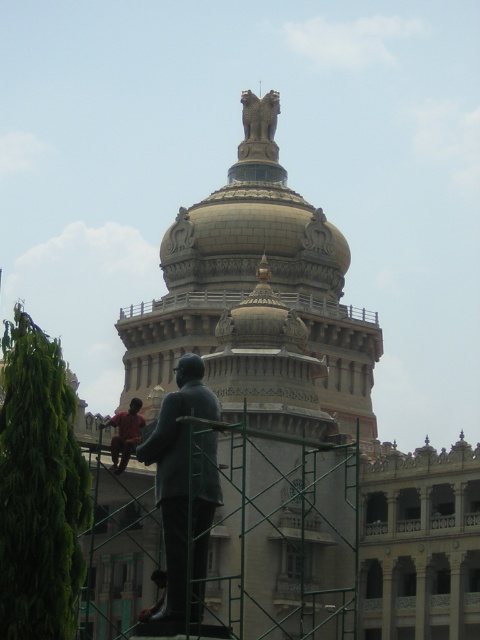
Question: Which point is closer to the camera?

Choices:
 (A) gold stone dome at upper center
 (B) bronze statue at lower left
 (C) bronze statue at upper center

Answer: (B)

Question: Based on their relative distances, which object is nearer to the red shirt at lower left?

Choices:
 (A) gold stone dome at upper center
 (B) bronze statue at upper center
 (C) bronze statue at lower left

Answer: (C)

Question: Among these objects, which one is nearest to the camera?

Choices:
 (A) bronze statue at upper center
 (B) red shirt at lower left
 (C) bronze statue at lower left
 (D) gold stone dome at upper center

Answer: (C)

Question: Is bronze statue at upper center thinner than red shirt at lower left?

Choices:
 (A) yes
 (B) no

Answer: (A)

Question: Where is gold stone dome at upper center located in relation to bronze statue at upper center in the image?

Choices:
 (A) above
 (B) below

Answer: (B)

Question: Does bronze statue at lower left appear under red shirt at lower left?

Choices:
 (A) yes
 (B) no

Answer: (A)